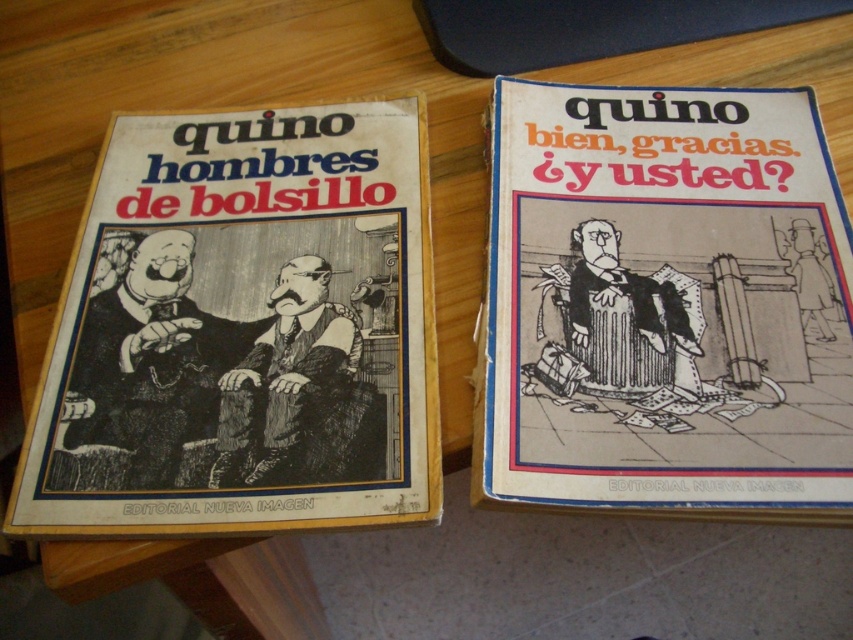
Question: Is black paper book at center below black ink drawing of man at center?

Choices:
 (A) yes
 (B) no

Answer: (B)

Question: Which point is farther from the camera taking this photo?

Choices:
 (A) (578, 273)
 (B) (422, 259)
 (C) (682, 216)

Answer: (C)

Question: Is black paper book at left below black paper book at center?

Choices:
 (A) yes
 (B) no

Answer: (A)

Question: Considering the real-world distances, which object is closest to the black line art man at center?

Choices:
 (A) black paper book at left
 (B) black ink drawing of man at center
 (C) black paper book at center

Answer: (C)

Question: Is black paper book at left thinner than black paper book at center?

Choices:
 (A) no
 (B) yes

Answer: (B)

Question: Which of the following is the farthest from the observer?

Choices:
 (A) black line art man at center
 (B) black paper book at center

Answer: (A)